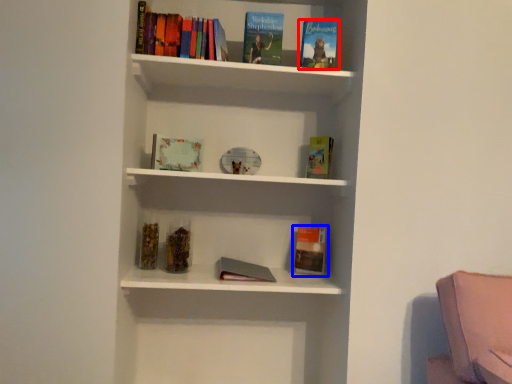
Question: Which point is further to the camera, book (highlighted by a red box) or paperback book (highlighted by a blue box)?

Choices:
 (A) book
 (B) paperback book

Answer: (B)